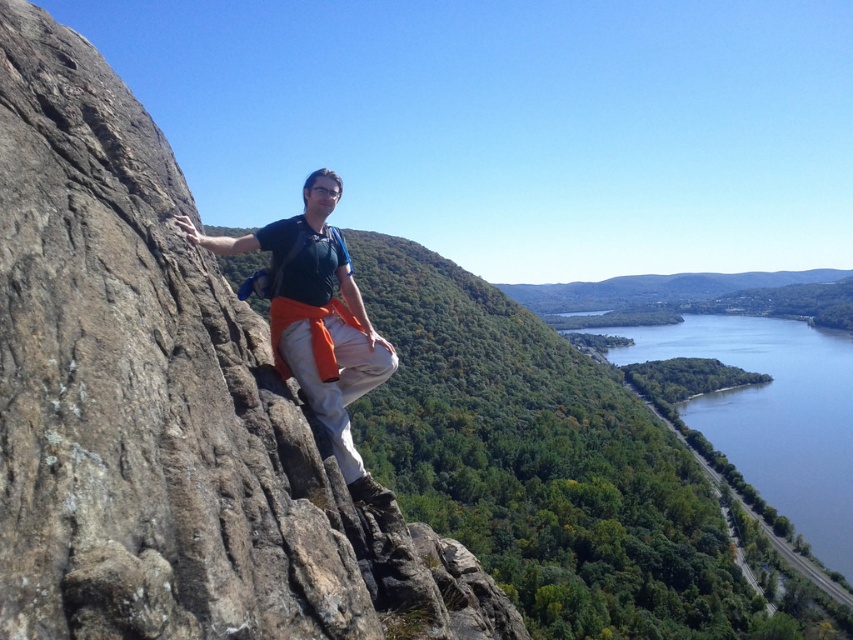
You are a drone operator planning to capture a photo of the blue glassy water at lower right and the matte black shirt at center from above. The camera has a maximum zoom range that can capture objects within a 500 meter distance. Will the drone be able to capture both objects in the same photo without moving?

The blue glassy water at lower right and the matte black shirt at center are 474.30 meters apart. Since the distance between them is within the 500 meter maximum zoom range, the drone can capture both objects in the same photo without moving.

You are standing at the cliff edge where the person is in the image. If you look towards the point specified as point (772, 413), what would you see?

You would see the blue glassy water at lower right at point (772, 413).

You are a photographer trying to capture the best angle of the person on the cliff. You notice two points marked in the image. The first point is at coordinate point [762,365] and the second is at point [329,339]. Which point is closer to your camera lens?

Point [329,339] is closer to the camera lens because the description states that point [762,365] is further away from the camera than point [329,339].